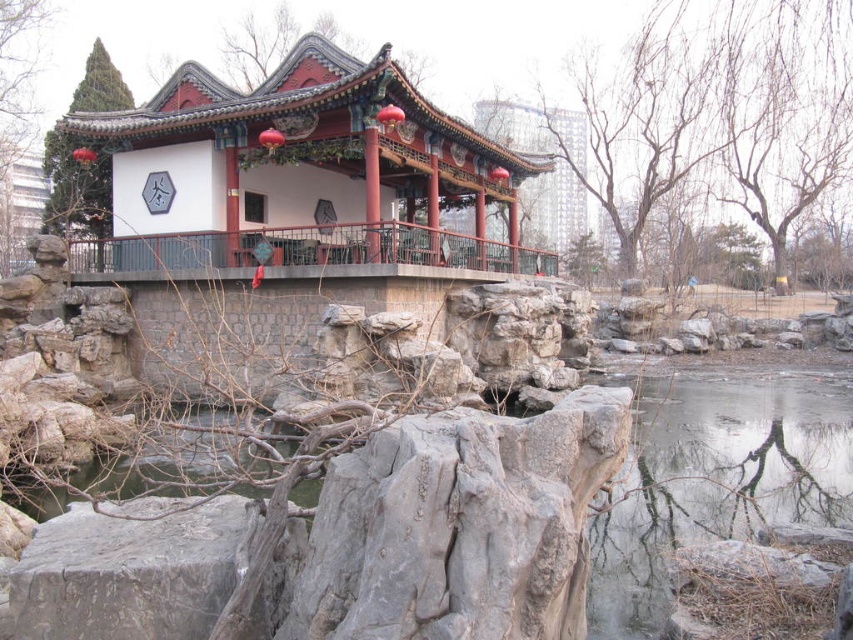
Question: Which point is farther to the camera?

Choices:
 (A) (82, 246)
 (B) (312, 84)

Answer: (A)

Question: Can you confirm if matte red gazebo at center is wider than rustic wood balcony at center?

Choices:
 (A) yes
 (B) no

Answer: (A)

Question: Which object is closer to the camera taking this photo?

Choices:
 (A) rustic wood balcony at center
 (B) matte red gazebo at center

Answer: (A)

Question: Does matte red gazebo at center appear on the right side of rustic wood balcony at center?

Choices:
 (A) no
 (B) yes

Answer: (A)

Question: Can you confirm if matte red gazebo at center is positioned to the right of rustic wood balcony at center?

Choices:
 (A) yes
 (B) no

Answer: (B)